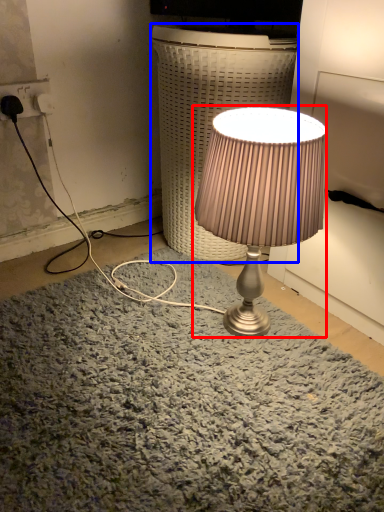
Question: Which object appears farthest to the camera in this image, lamp (highlighted by a red box) or table (highlighted by a blue box)?

Choices:
 (A) lamp
 (B) table

Answer: (B)